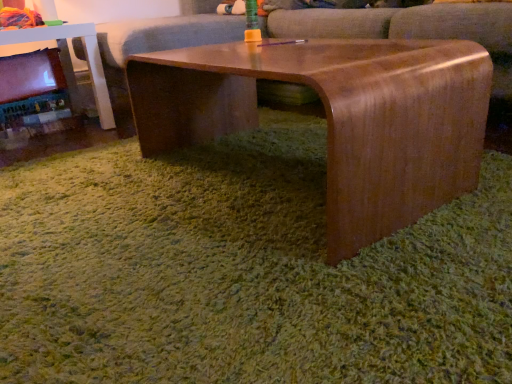
Where is `free spot in front of satin wood coffee table at center`? free spot in front of satin wood coffee table at center is located at coordinates (265, 280).